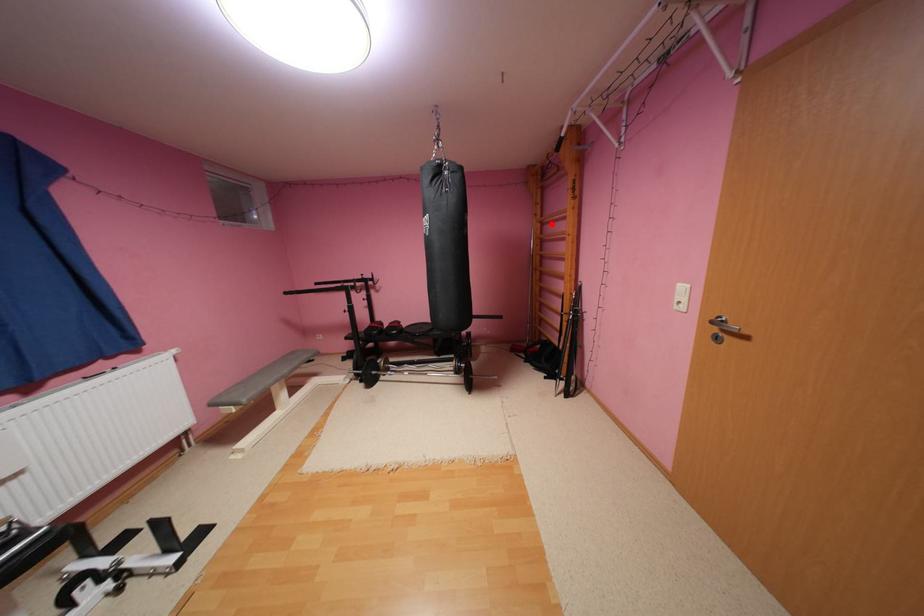
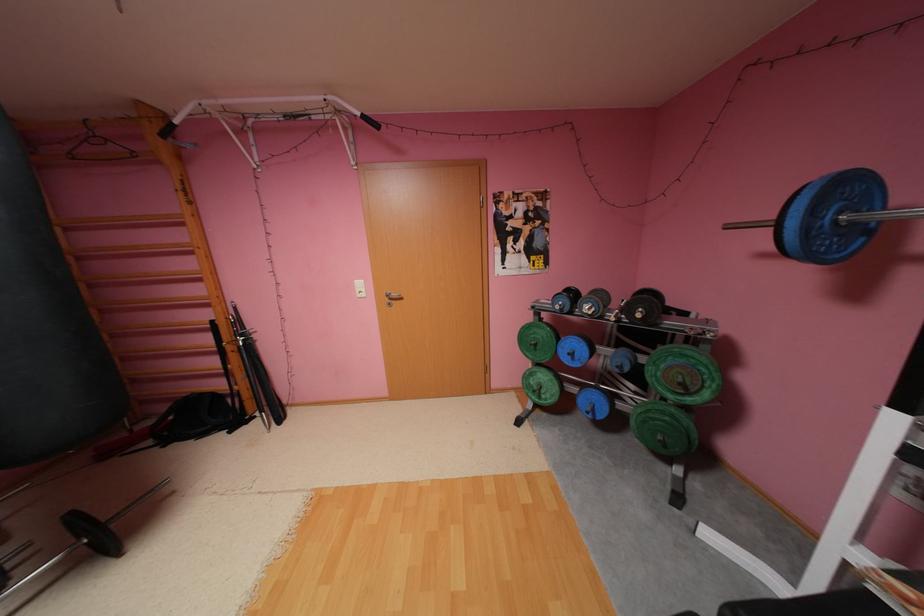
In the second image, find the point that corresponds to the highlighted location in the first image.

(76, 229)